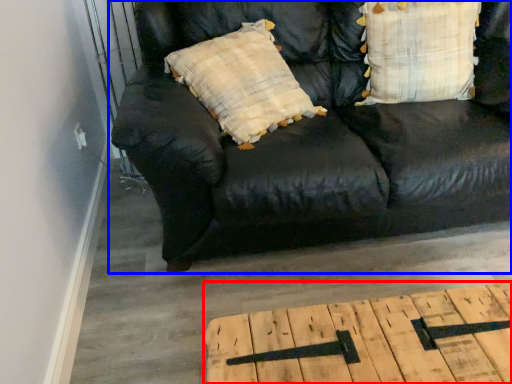
Question: Which of the following is the farthest to the observer, table (highlighted by a red box) or studio couch (highlighted by a blue box)?

Choices:
 (A) table
 (B) studio couch

Answer: (B)